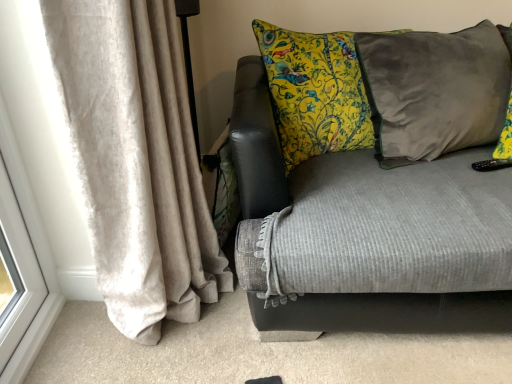
Question: Which is correct: beige velvet curtain at left is inside velvet gray couch at center, or outside of it?

Choices:
 (A) inside
 (B) outside

Answer: (B)

Question: In terms of width, does beige velvet curtain at left look wider or thinner when compared to velvet gray couch at center?

Choices:
 (A) thin
 (B) wide

Answer: (A)

Question: Estimate the real-world distances between objects in this image. Which object is closer to the velvet gray couch at center?

Choices:
 (A) velvet gray pillow at right
 (B) beige velvet curtain at left

Answer: (A)

Question: Which object is positioned farthest from the velvet gray pillow at right?

Choices:
 (A) velvet gray couch at center
 (B) beige velvet curtain at left

Answer: (B)